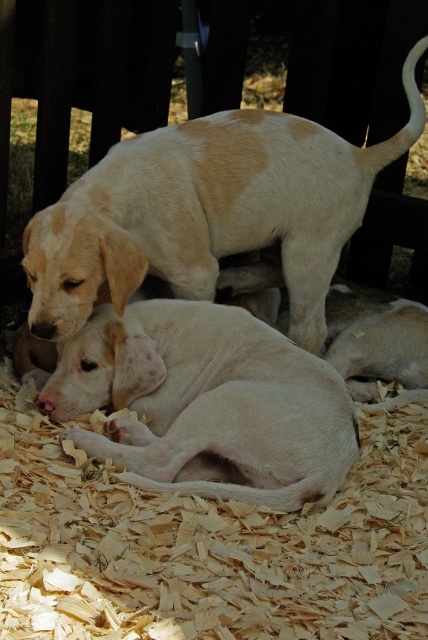
Who is more distant from viewer, (x=50, y=596) or (x=226, y=220)?

Point (x=226, y=220)

Can you confirm if light brown woodchip at lower center is taller than light brown fur at upper center?

Incorrect, light brown woodchip at lower center's height is not larger of light brown fur at upper center's.

Who is more distant from viewer, (113, 628) or (109, 216)?

Point (109, 216)

Locate an element on the screen. The width and height of the screenshot is (428, 640). light brown woodchip at lower center is located at coordinates [208, 547].

Can you confirm if light brown fur at upper center is positioned below light beige fur at center?

Incorrect, light brown fur at upper center is not positioned below light beige fur at center.

Is light brown fur at upper center thinner than light beige fur at center?

No, light brown fur at upper center is not thinner than light beige fur at center.

This screenshot has width=428, height=640. In order to click on light brown fur at upper center in this screenshot , I will do `click(208, 212)`.

Identify the location of light brown fur at upper center. This screenshot has height=640, width=428. (208, 212).

Is light brown woodchip at lower center in front of light beige fur at center?

Yes.

Who is more distant from viewer, (327,593) or (133,481)?

Point (133,481)

You are a GUI agent. You are given a task and a screenshot of the screen. Output one action in this format:
    pyautogui.click(x=<x>, y=<y>)
    Task: Click on the light brown woodchip at lower center
    The width and height of the screenshot is (428, 640).
    Given the screenshot: What is the action you would take?
    pyautogui.click(x=208, y=547)